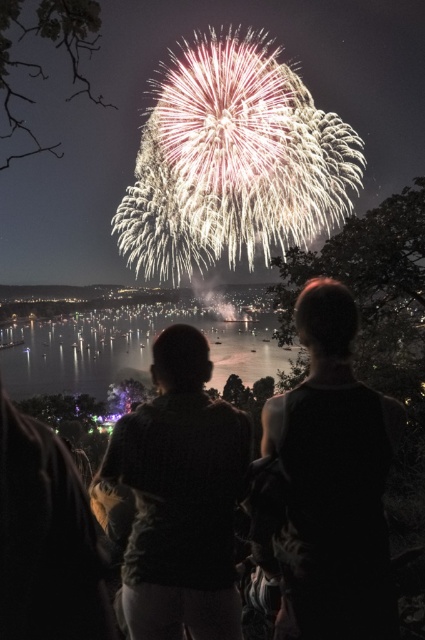
Question: Can you confirm if black fabric at center is bigger than silvery reflective water at center?

Choices:
 (A) yes
 (B) no

Answer: (B)

Question: Which point is farther to the camera?

Choices:
 (A) silvery reflective water at center
 (B) black fabric at center

Answer: (A)

Question: Does black fabric at center appear on the right side of dark textured shirt at center?

Choices:
 (A) yes
 (B) no

Answer: (A)

Question: Which point appears farthest from the camera in this image?

Choices:
 (A) (385, 483)
 (B) (36, 339)
 (C) (224, 598)

Answer: (B)

Question: Which point appears farthest from the camera in this image?

Choices:
 (A) (112, 381)
 (B) (155, 500)
 (C) (323, 529)

Answer: (A)

Question: Is the position of dark textured shirt at center less distant than that of silvery reflective water at center?

Choices:
 (A) yes
 (B) no

Answer: (A)